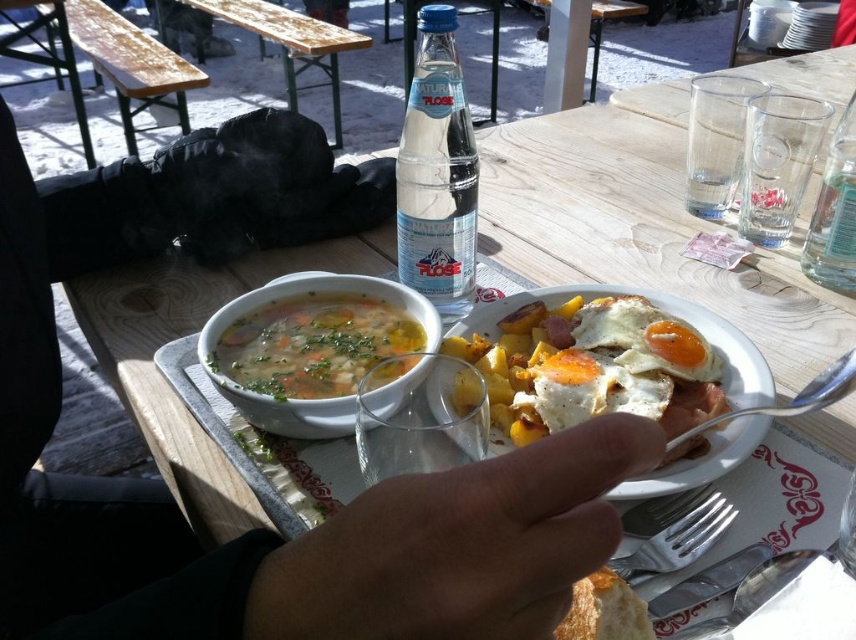
Question: Which point is farther to the camera?

Choices:
 (A) satin silver spoon at upper right
 (B) skinny flesh at center
 (C) golden crispy bread at lower center

Answer: (A)

Question: Which point is closer to the camera?

Choices:
 (A) shiny metallic fork at lower right
 (B) golden crispy bread at lower center

Answer: (B)

Question: Does white ceramic bowl at center lie in front of golden crispy bread at lower center?

Choices:
 (A) yes
 (B) no

Answer: (B)

Question: Is the position of golden crispy bread at lower center more distant than that of satin silver spoon at upper right?

Choices:
 (A) yes
 (B) no

Answer: (B)

Question: Is the position of skinny flesh at center more distant than that of clear glass bottle at center?

Choices:
 (A) yes
 (B) no

Answer: (B)

Question: Which point appears farthest from the camera in this image?

Choices:
 (A) (736, 566)
 (B) (759, 577)
 (C) (848, 365)
 (D) (533, 582)

Answer: (C)